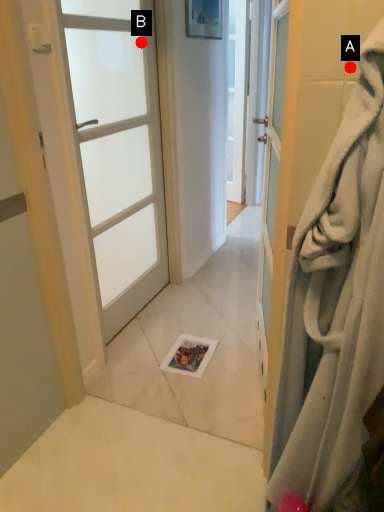
Question: Two points are circled on the image, labeled by A and B beside each circle. Which point appears farthest from the camera in this image?

Choices:
 (A) A is further
 (B) B is further

Answer: (B)